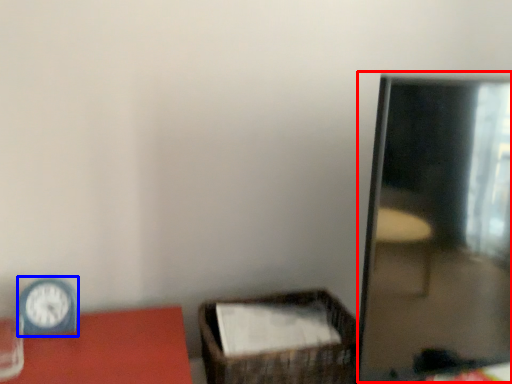
Question: Which object is further to the camera taking this photo, mirror (highlighted by a red box) or clock (highlighted by a blue box)?

Choices:
 (A) mirror
 (B) clock

Answer: (B)